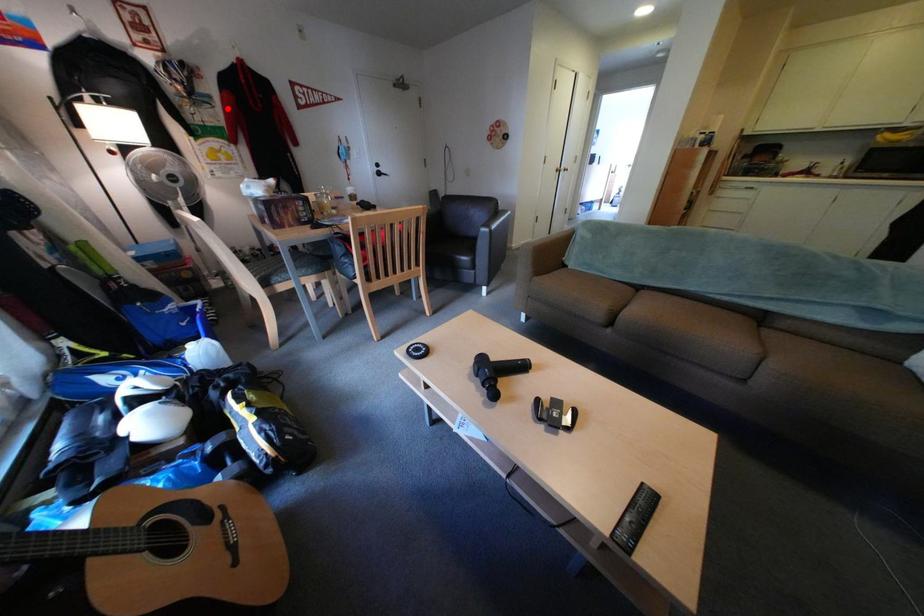
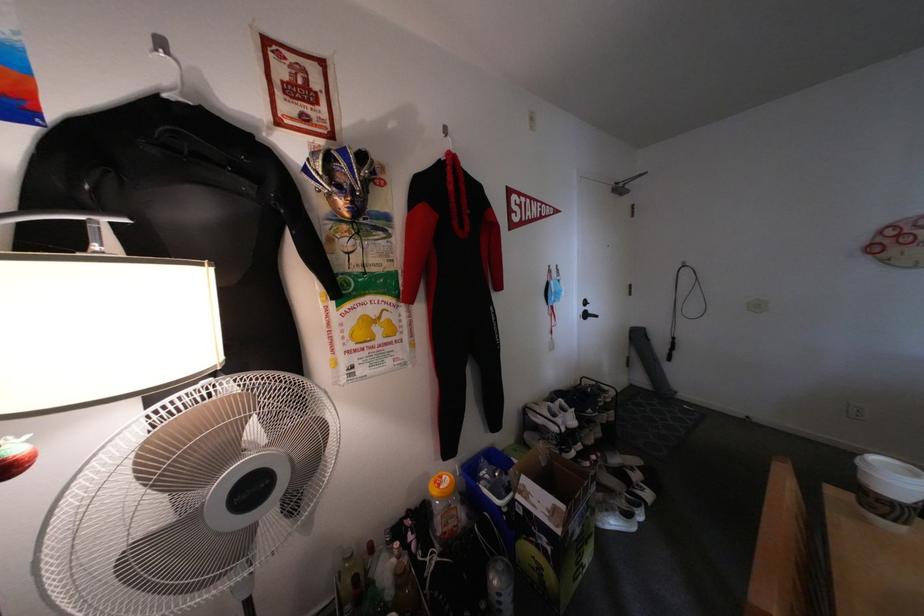
In the second image, find the point that corresponds to the highlighted location in the first image.

(404, 237)